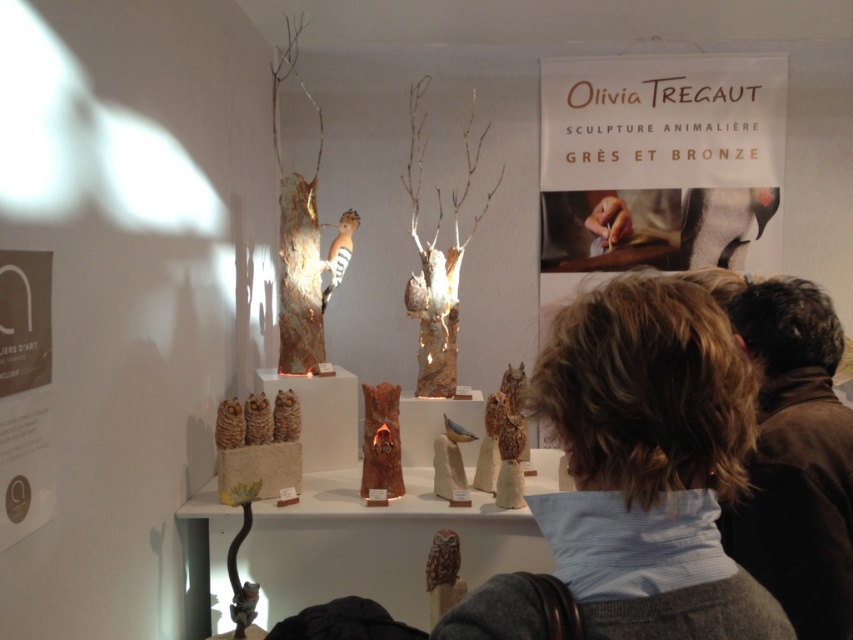
Which of these two, blonde hair at center or brown fuzzy jacket at upper right, stands taller?

brown fuzzy jacket at upper right

Does blonde hair at center appear on the left side of brown fuzzy jacket at upper right?

Yes, blonde hair at center is to the left of brown fuzzy jacket at upper right.

Is point (584, 609) in front of point (796, 529)?

Yes, point (584, 609) is in front of point (796, 529).

Locate an element on the screen. This screenshot has height=640, width=853. blonde hair at center is located at coordinates coord(648,461).

Which is above, matte brown sign at left or brown matte owl at center?

brown matte owl at center is higher up.

Where is `matte brown sign at left`? Image resolution: width=853 pixels, height=640 pixels. matte brown sign at left is located at coordinates (24, 394).

Between point (790, 372) and point (381, 381), which one is positioned behind?

The point (381, 381) is behind.

Who is more distant from viewer, (802, 538) or (398, 408)?

The point (398, 408) is behind.

Image resolution: width=853 pixels, height=640 pixels. I want to click on brown fuzzy jacket at upper right, so click(795, 456).